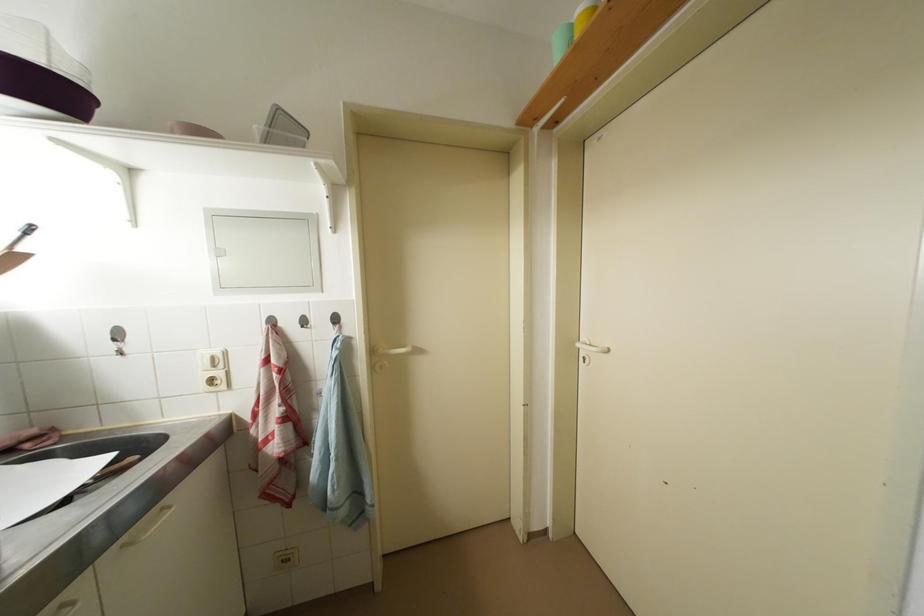
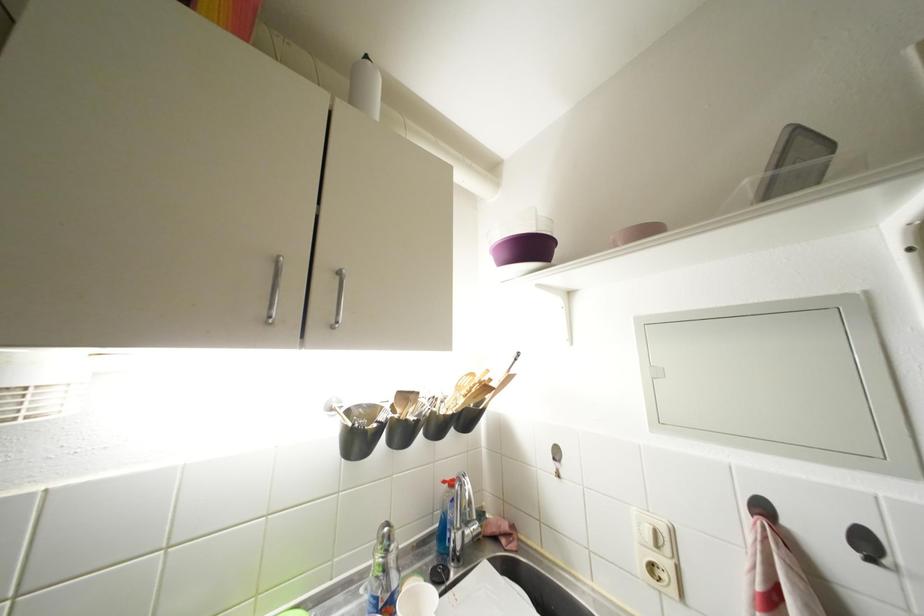
The point at (221, 370) is marked in the first image. Where is the corresponding point in the second image?

(663, 549)